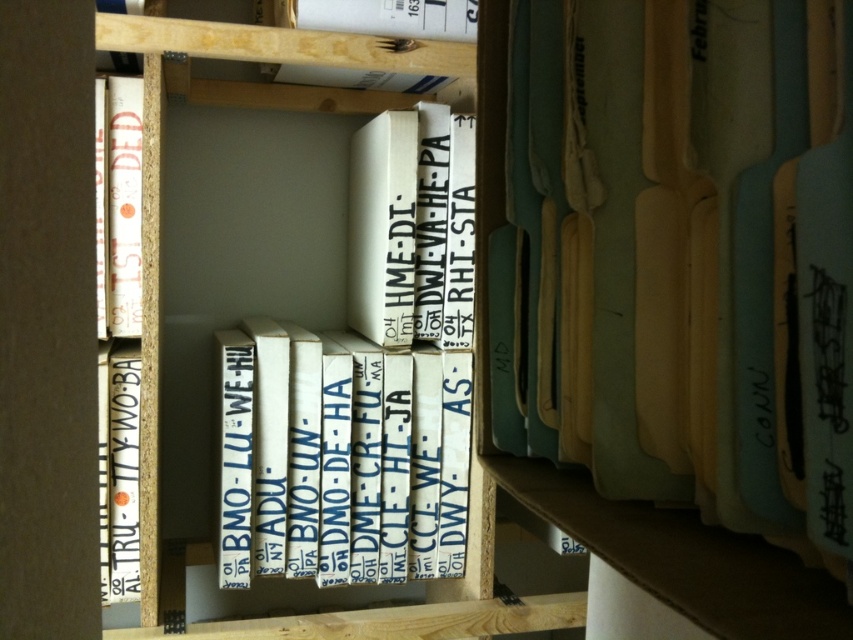
Question: From the image, what is the correct spatial relationship of light blue cardboard box at center in relation to white cardboard box at center?

Choices:
 (A) right
 (B) left

Answer: (A)

Question: Considering the real-world distances, which object is farthest from the white cardboard box at center?

Choices:
 (A) light blue cardboard box at center
 (B) white cardboard book at center

Answer: (A)

Question: Is white cardboard box at center to the right of white cardboard book at center from the viewer's perspective?

Choices:
 (A) yes
 (B) no

Answer: (A)

Question: Which of the following is the closest to the observer?

Choices:
 (A) (683, 68)
 (B) (107, 580)
 (C) (254, 328)

Answer: (A)

Question: Based on their relative distances, which object is nearer to the white cardboard boxes at center?

Choices:
 (A) white cardboard book at center
 (B) white cardboard box at center
 (C) light blue cardboard box at center

Answer: (B)

Question: Is white cardboard boxes at center smaller than white cardboard box at center?

Choices:
 (A) no
 (B) yes

Answer: (A)